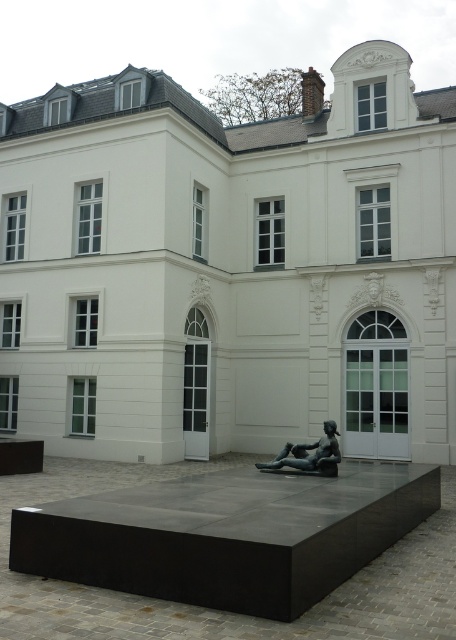
You are standing at the entrance of the white smooth building at center. If you walk straight ahead, will you face the sculpture or the brick chimney?

The brick chimney is located on the roof of the white smooth building at center, so facing the building directly ahead would mean the chimney is visible on its roof, not the sculpture which is in front of it.